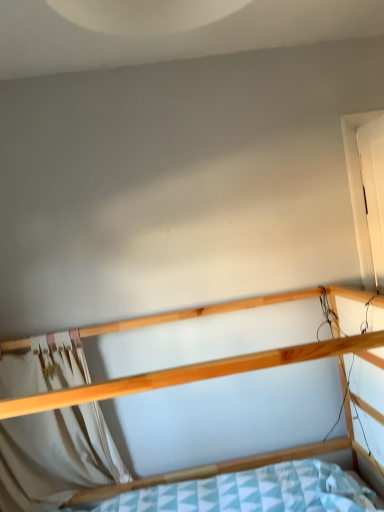
What do you see at coordinates (56, 457) in the screenshot? The image size is (384, 512). I see `white fabric curtain at lower left` at bounding box center [56, 457].

Where is `white fabric curtain at lower left`? The image size is (384, 512). white fabric curtain at lower left is located at coordinates (56, 457).

In order to face white matte door at right, should I rotate leftwards or rightwards?

A 24.323 degree turn to the right will do.

Where is `white fabric curtain at lower left`? white fabric curtain at lower left is located at coordinates (56, 457).

Is white matte door at right wider than white fabric curtain at lower left?

Yes.

Is white matte door at right inside the boundaries of white fabric curtain at lower left, or outside?

white matte door at right is spatially situated outside white fabric curtain at lower left.

Can you confirm if white matte door at right is shorter than white fabric curtain at lower left?

Incorrect, the height of white matte door at right does not fall short of that of white fabric curtain at lower left.

Identify the location of curtain located above the natural wood bed at center (from the image's perspective). This screenshot has height=512, width=384. (56, 457).

How different are the orientations of white fabric curtain at lower left and natural wood bed at center in degrees?

There is a 1.04-degree angle between the facing directions of white fabric curtain at lower left and natural wood bed at center.

Is white fabric curtain at lower left in contact with natural wood bed at center?

No, white fabric curtain at lower left is not touching natural wood bed at center.

Is white fabric curtain at lower left further to the viewer compared to natural wood bed at center?

Yes, the depth of white fabric curtain at lower left is greater than that of natural wood bed at center.

Can you confirm if white matte door at right is smaller than natural wood bed at center?

Correct, white matte door at right occupies less space than natural wood bed at center.

How different are the orientations of white matte door at right and natural wood bed at center in degrees?

They differ by 93.2 degrees in their facing directions.

Considering the positions of objects white matte door at right and natural wood bed at center in the image provided, who is more to the right, white matte door at right or natural wood bed at center?

Positioned to the right is white matte door at right.

Is natural wood bed at center surrounded by white matte door at right?

No.

Which object is wider, natural wood bed at center or white matte door at right?

natural wood bed at center.

Based on the photo, is white matte door at right completely or partially inside natural wood bed at center?

No.

Would you say natural wood bed at center is a long distance from white matte door at right?

No, natural wood bed at center is not far away from white matte door at right.

In the image, is natural wood bed at center on the left side or the right side of white matte door at right?

natural wood bed at center is positioned on white matte door at right's left side.

Is white fabric curtain at lower left at the back of natural wood bed at center?

That's right, natural wood bed at center is facing away from white fabric curtain at lower left.

Which object is further away from the camera, natural wood bed at center or white fabric curtain at lower left?

white fabric curtain at lower left is behind.

Does point (184, 382) come closer to viewer compared to point (92, 426)?

Yes, it is.

Locate an element on the screen. The height and width of the screenshot is (512, 384). window in front of the white fabric curtain at lower left is located at coordinates (358, 192).

What's the angular difference between white fabric curtain at lower left and white matte door at right's facing directions?

The facing directions of white fabric curtain at lower left and white matte door at right are 94.3 degrees apart.

Is white fabric curtain at lower left thinner than white matte door at right?

Indeed, white fabric curtain at lower left has a lesser width compared to white matte door at right.

From the image's perspective, is white fabric curtain at lower left on top of white matte door at right?

No, from the image's perspective, white fabric curtain at lower left is not above white matte door at right.

Locate an element on the screen. window to the right of white fabric curtain at lower left is located at coordinates (358, 192).

Locate an element on the screen. curtain to the left of natural wood bed at center is located at coordinates (56, 457).

Based on their spatial positions, is white matte door at right or white fabric curtain at lower left further from natural wood bed at center?

white matte door at right is further to natural wood bed at center.

Based on their spatial positions, is natural wood bed at center or white fabric curtain at lower left closer to white matte door at right?

natural wood bed at center.

From the image, which object appears to be nearer to natural wood bed at center, white fabric curtain at lower left or white matte door at right?

white fabric curtain at lower left is closer to natural wood bed at center.

From the image, which object appears to be farther from white matte door at right, white fabric curtain at lower left or natural wood bed at center?

Among the two, white fabric curtain at lower left is located further to white matte door at right.

Estimate the real-world distances between objects in this image. Which object is further from white fabric curtain at lower left, natural wood bed at center or white matte door at right?

white matte door at right lies further to white fabric curtain at lower left than the other object.

Based on their spatial positions, is white matte door at right or natural wood bed at center closer to white fabric curtain at lower left?

The object closer to white fabric curtain at lower left is natural wood bed at center.

Where is `bed between white fabric curtain at lower left and white matte door at right`? This screenshot has height=512, width=384. bed between white fabric curtain at lower left and white matte door at right is located at coordinates (167, 377).